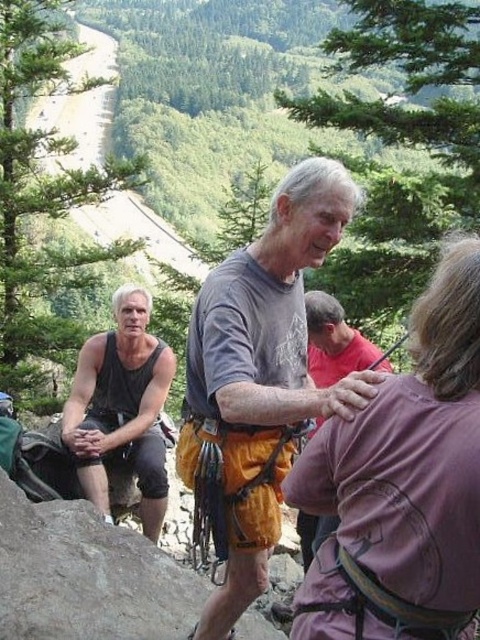
Question: Is the position of gray cotton shirt at center less distant than that of orange climbing harness at center?

Choices:
 (A) yes
 (B) no

Answer: (A)

Question: Which of the following is the closest to the observer?

Choices:
 (A) purple fabric at center
 (B) orange climbing harness at center
 (C) black mesh tank top at left
 (D) gray cotton shirt at center

Answer: (A)

Question: Which point is closer to the camera taking this photo?

Choices:
 (A) (269, 280)
 (B) (309, 332)

Answer: (A)

Question: Is gray cotton shirt at center to the left of orange climbing harness at center from the viewer's perspective?

Choices:
 (A) no
 (B) yes

Answer: (B)

Question: Which of the following is the closest to the observer?

Choices:
 (A) orange climbing harness at center
 (B) gray cotton shirt at center

Answer: (B)

Question: Can you confirm if black mesh tank top at left is positioned to the right of orange climbing harness at center?

Choices:
 (A) yes
 (B) no

Answer: (B)